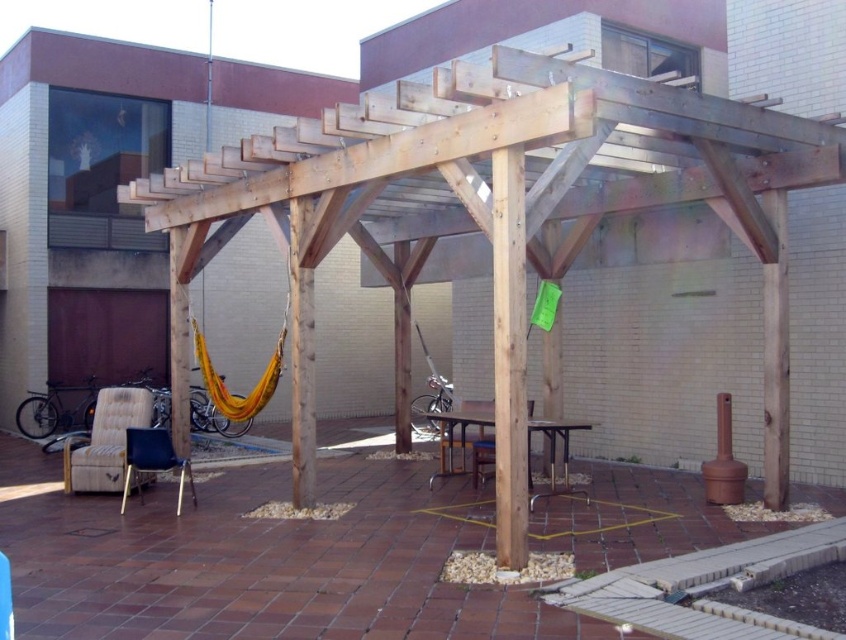
Consider the image. Can you confirm if beige fabric chair at lower left is positioned below metallic gray chair at lower left?

Incorrect, beige fabric chair at lower left is not positioned below metallic gray chair at lower left.

Measure the distance from beige fabric chair at lower left to metallic gray chair at lower left.

beige fabric chair at lower left and metallic gray chair at lower left are 25.76 inches apart from each other.

Locate an element on the screen. beige fabric chair at lower left is located at coordinates (105, 440).

Identify the location of beige fabric chair at lower left. This screenshot has height=640, width=846. (105, 440).

Can you confirm if beige fabric chair at lower left is positioned above wooden chair at center?

Indeed, beige fabric chair at lower left is positioned over wooden chair at center.

Is beige fabric chair at lower left bigger than wooden chair at center?

Indeed, beige fabric chair at lower left has a larger size compared to wooden chair at center.

Between point (117, 486) and point (481, 426), which one is positioned behind?

Point (481, 426)

The image size is (846, 640). What are the coordinates of `beige fabric chair at lower left` in the screenshot? It's located at (105, 440).

Is point (147, 468) farther from viewer compared to point (482, 467)?

No, it is not.

Between point (136, 440) and point (529, 442), which one is positioned in front?

Point (136, 440) is more forward.

Does point (140, 458) lie in front of point (481, 461)?

That is True.

Image resolution: width=846 pixels, height=640 pixels. What are the coordinates of `metallic gray chair at lower left` in the screenshot? It's located at 152,460.